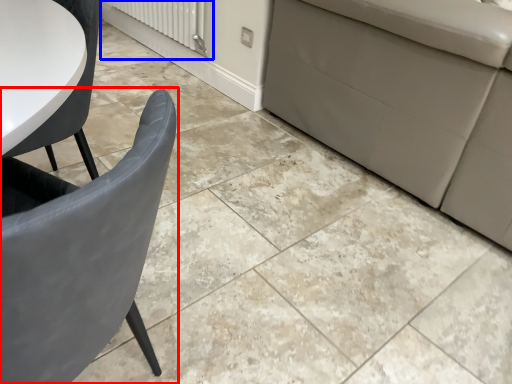
Question: Which point is further to the camera, chair (highlighted by a red box) or radiator (highlighted by a blue box)?

Choices:
 (A) chair
 (B) radiator

Answer: (B)